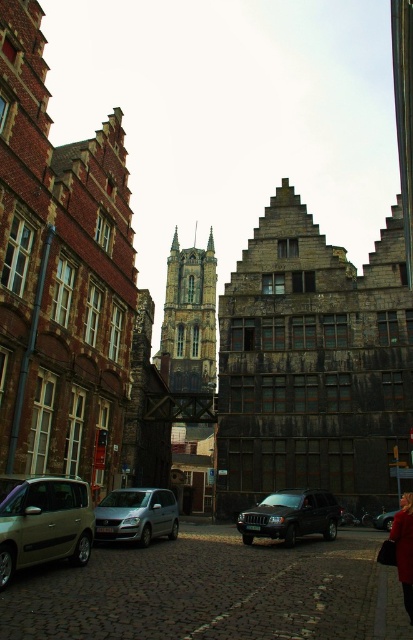
You are a delivery driver trying to park your vehicle in this historic town. You have a black matte suv at center and a silver metallic van at center in front of you. Which vehicle should you move to the left to allow space for a larger truck arriving soon?

The black matte suv at center is to the right of the silver metallic van at center. To allow space for the larger truck, you should move the silver metallic van at center to the left since it is currently positioned to the left of the suv.

You are a delivery person trying to park your black matte suv at center in a parking spot near the red leather coat at lower right. The parking spot has a height restriction of 1.8 meters. Can you safely park your suv there?

The black matte suv at center is not as tall as the red leather coat at lower right, but since the red leather coat at lower right is not mentioned to have a specific height, it is unclear if the suv meets the 1.8 meter height restriction. Check the suv height before parking.

You are a tourist in the historic town and want to take a photo of the black matte suv at center and the red leather coat at lower right. Which object should you focus on first if you want to capture both in the same frame without zooming in or out?

The black matte suv at center is smaller than the red leather coat at lower right, so you should focus on the black matte suv at center first to ensure both fit in the frame without zooming.